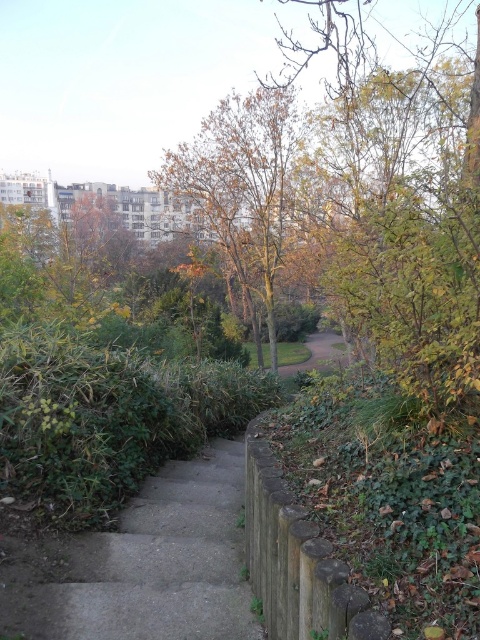
You are a landscape architect designing a garden. You need to place a small statue between the green leafy tree at upper center and the green grass at center. Which object should the statue be closer to if you want it to appear proportionally balanced with both?

The statue should be closer to the green grass at center because the green leafy tree at upper center is larger in size than the green grass at center, so placing the statue nearer to the smaller object helps achieve a balanced look.

Looking at this image, you are standing at the bottom of the concrete stairs in the foreground. Looking towards the middle ground, where is the brown leafy tree at center located in relation to your current position?

The brown leafy tree at center is located in the middle ground, directly ahead of your current position at the bottom of the concrete stairs.